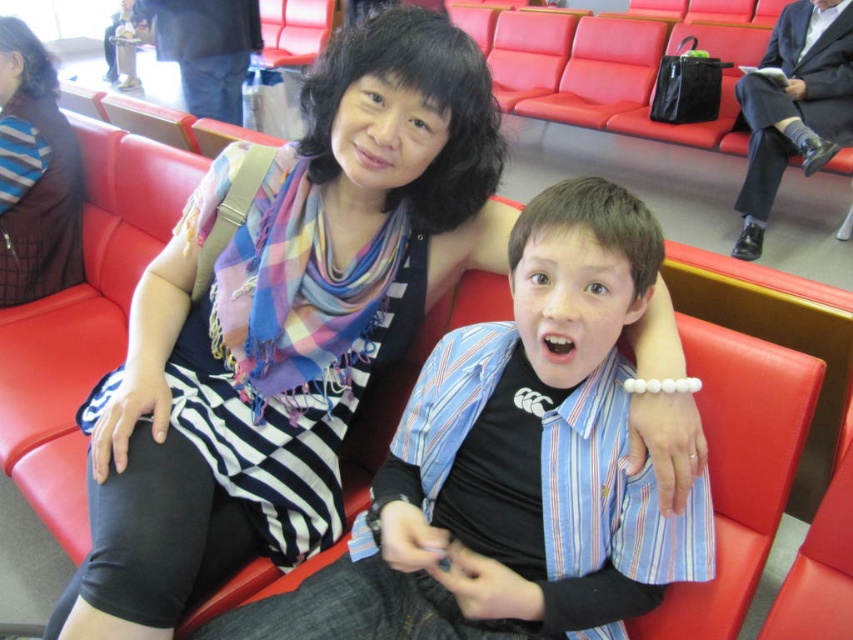
You are designing a new seating arrangement for this waiting area. The striped shirt at center and the striped fabric scarf at upper left are both part of the decor. Which object has a greater width?

The striped shirt at center has a greater width than the striped fabric scarf at upper left.

You are a security guard in the waiting area and need to locate the striped shirt at center. Based on the coordinates provided in the scene description, can you confirm its position relative to the red bench?

The striped shirt at center is located at point coordinates [514,464], which places it on the red bench in the background as described.